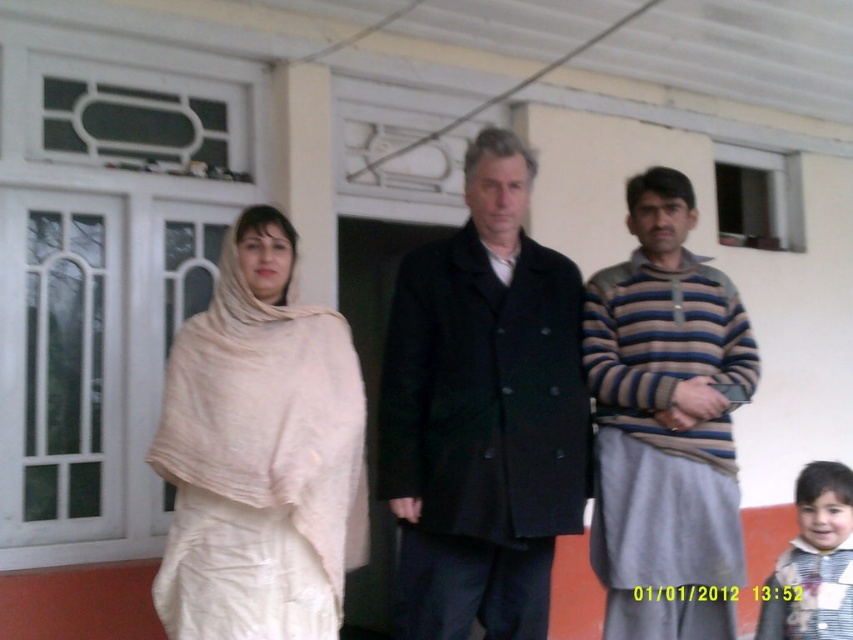
You are standing in front of the building with a white facade and a red base. You notice two points marked on the building. The first point is at coordinate point [393,600] and the second is at point [670,596]. From your perspective, which point is closer to you?

Point [670,596] is closer to you because point [393,600] is behind it.